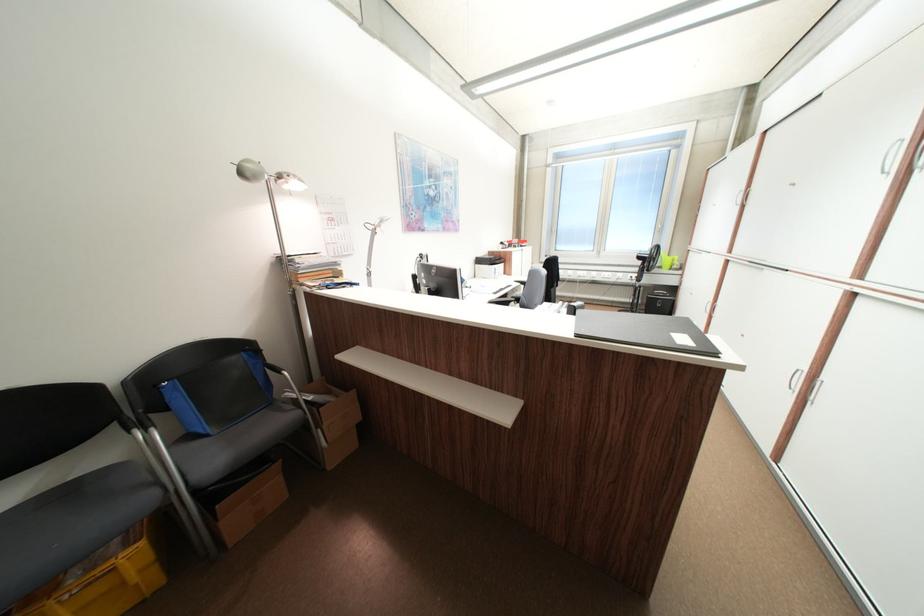
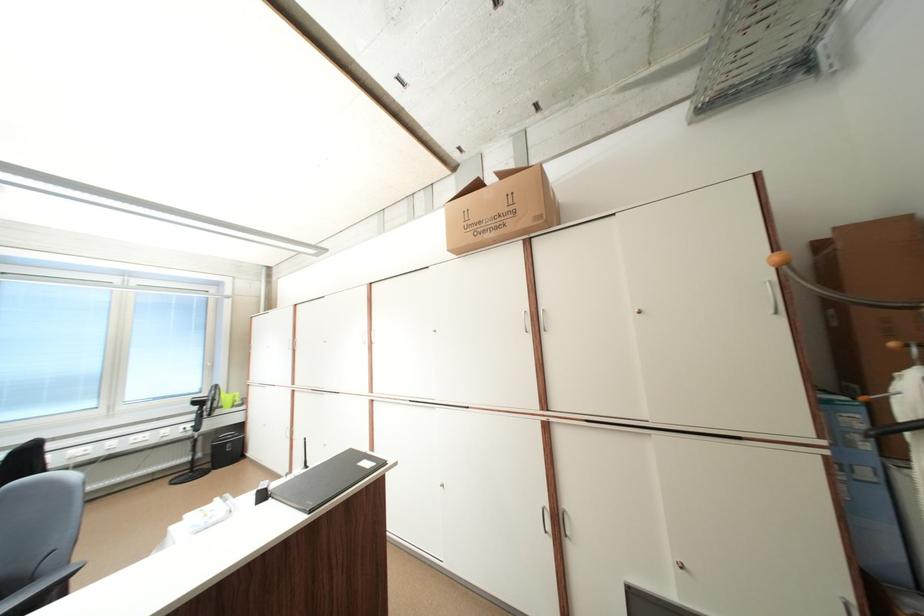
Question: The images are taken continuously from a first-person perspective. In which direction is your viewpoint rotating?

Choices:
 (A) Left
 (B) Right
 (C) Up
 (D) Down

Answer: (B)